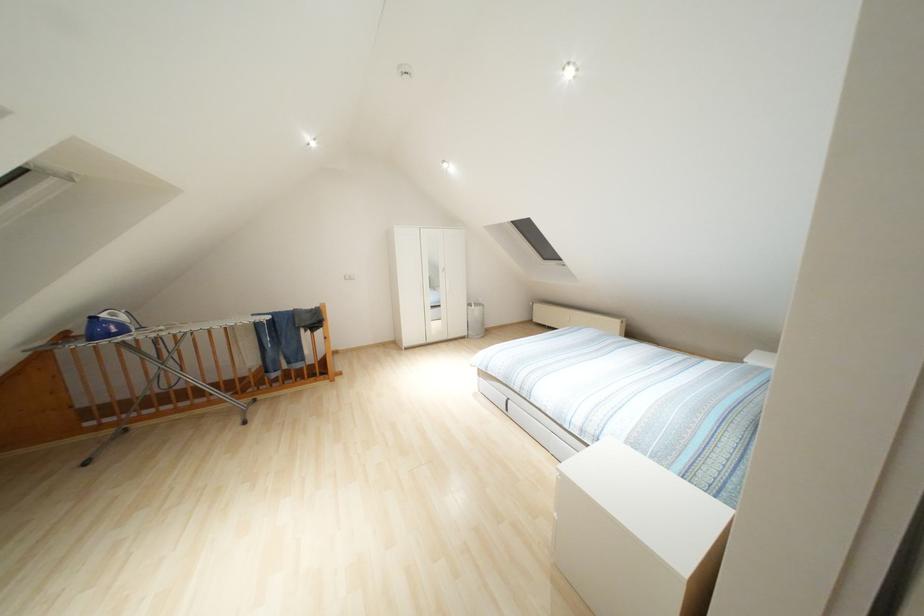
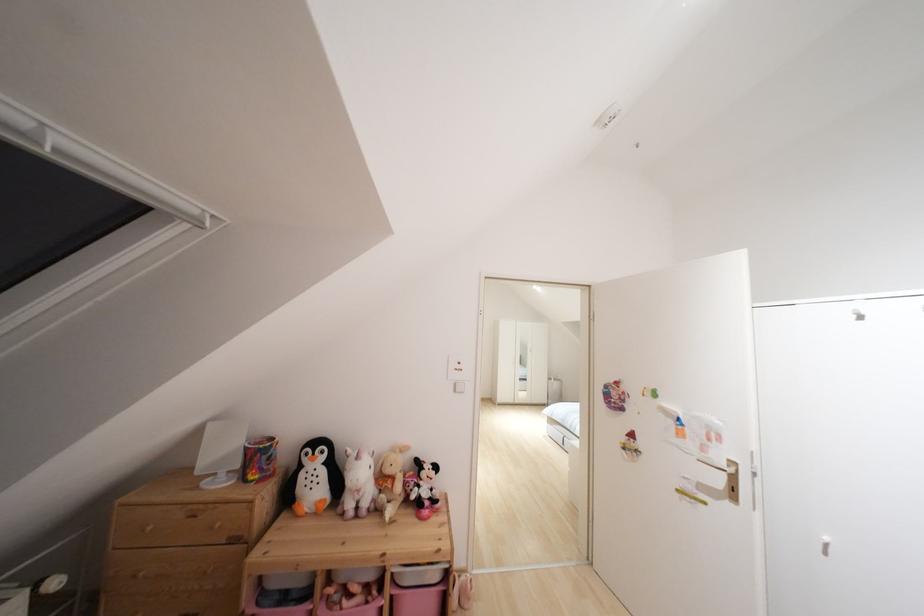
Question: What movement of the cameraman would produce the second image?

Choices:
 (A) Left
 (B) Right
 (C) Forward
 (D) Backward

Answer: (D)